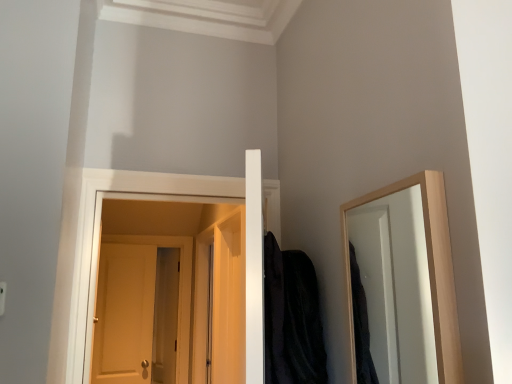
Question: In terms of width, does black velvet robe at center look wider or thinner when compared to matte wooden door at center?

Choices:
 (A) thin
 (B) wide

Answer: (B)

Question: Would you say black velvet robe at center is inside or outside matte wooden door at center?

Choices:
 (A) outside
 (B) inside

Answer: (A)

Question: In terms of height, does black velvet robe at center look taller or shorter compared to matte wooden door at center?

Choices:
 (A) short
 (B) tall

Answer: (A)

Question: From a real-world perspective, relative to black velvet robe at center, is matte wooden door at center vertically above or below?

Choices:
 (A) above
 (B) below

Answer: (B)

Question: In the image, is matte wooden door at center on the left side or the right side of black velvet robe at center?

Choices:
 (A) right
 (B) left

Answer: (B)

Question: From the image's perspective, is matte wooden door at center above or below black velvet robe at center?

Choices:
 (A) above
 (B) below

Answer: (B)

Question: Looking at their shapes, would you say matte wooden door at center is wider or thinner than black velvet robe at center?

Choices:
 (A) thin
 (B) wide

Answer: (A)